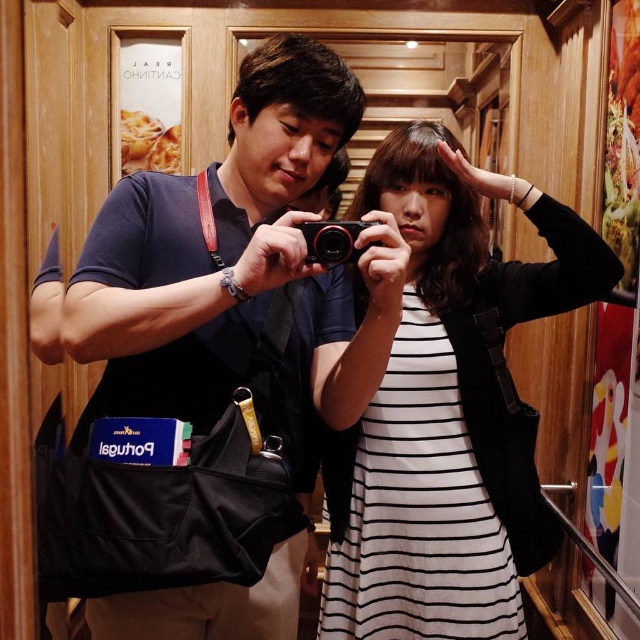
Question: Which of the following is the farthest from the observer?

Choices:
 (A) (278, 204)
 (B) (330, 237)

Answer: (A)

Question: Can you confirm if dark blue fabric shirt at center is bigger than white striped dress at center?

Choices:
 (A) yes
 (B) no

Answer: (A)

Question: Which object is closer to the camera taking this photo?

Choices:
 (A) white striped dress at center
 (B) black plastic camera at center

Answer: (B)

Question: Does dark blue fabric shirt at center have a greater width compared to black plastic camera at center?

Choices:
 (A) yes
 (B) no

Answer: (A)

Question: Which is farther from the dark blue fabric shirt at center?

Choices:
 (A) white striped dress at center
 (B) black plastic camera at center

Answer: (A)

Question: Is white striped dress at center above black plastic camera at center?

Choices:
 (A) yes
 (B) no

Answer: (B)